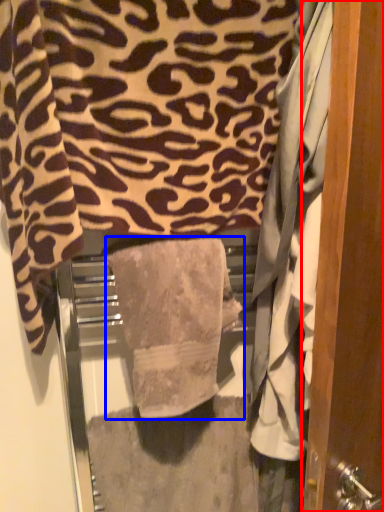
Question: Which object is closer to the camera taking this photo, door (highlighted by a red box) or towel (highlighted by a blue box)?

Choices:
 (A) door
 (B) towel

Answer: (A)